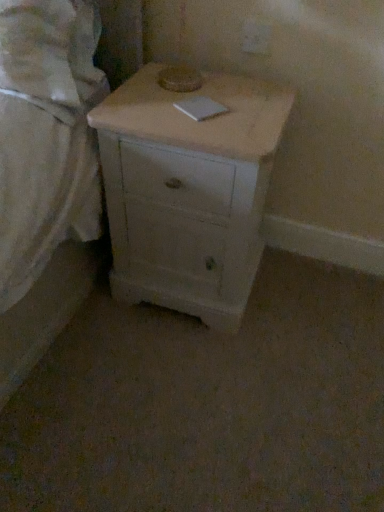
Question: Is white matte chest of drawers at center surrounded by white matte bed at left?

Choices:
 (A) yes
 (B) no

Answer: (B)

Question: Considering the relative positions of white matte bed at left and white matte chest of drawers at center in the image provided, is white matte bed at left to the left of white matte chest of drawers at center from the viewer's perspective?

Choices:
 (A) yes
 (B) no

Answer: (A)

Question: Is white matte bed at left outside white matte chest of drawers at center?

Choices:
 (A) yes
 (B) no

Answer: (A)

Question: Is white matte bed at left wider than white matte chest of drawers at center?

Choices:
 (A) no
 (B) yes

Answer: (A)

Question: Does white matte bed at left come behind white matte chest of drawers at center?

Choices:
 (A) no
 (B) yes

Answer: (A)

Question: From a real-world perspective, is white matte bed at left positioned under white matte chest of drawers at center based on gravity?

Choices:
 (A) yes
 (B) no

Answer: (B)

Question: Is white matte bed at left a part of white matte chest of drawers at center?

Choices:
 (A) yes
 (B) no

Answer: (B)

Question: Does white matte chest of drawers at center have a greater height compared to white matte bed at left?

Choices:
 (A) yes
 (B) no

Answer: (A)

Question: Is white matte chest of drawers at center bigger than white matte bed at left?

Choices:
 (A) no
 (B) yes

Answer: (B)

Question: Can you confirm if white matte chest of drawers at center is thinner than white matte bed at left?

Choices:
 (A) no
 (B) yes

Answer: (A)

Question: Does white matte chest of drawers at center appear on the left side of white matte bed at left?

Choices:
 (A) yes
 (B) no

Answer: (B)

Question: Is white matte chest of drawers at center oriented towards white matte bed at left?

Choices:
 (A) yes
 (B) no

Answer: (B)

Question: Is white matte bed at left wider or thinner than white matte chest of drawers at center?

Choices:
 (A) wide
 (B) thin

Answer: (B)